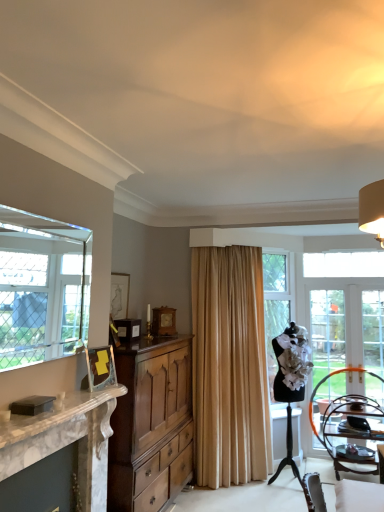
Question: Does clear glass window at left contain clear glass door at right?

Choices:
 (A) yes
 (B) no

Answer: (B)

Question: Is clear glass window at left smaller than clear glass door at right?

Choices:
 (A) no
 (B) yes

Answer: (B)

Question: Does clear glass window at left have a lesser width compared to clear glass door at right?

Choices:
 (A) yes
 (B) no

Answer: (A)

Question: Is there a large distance between clear glass window at left and clear glass door at right?

Choices:
 (A) no
 (B) yes

Answer: (B)

Question: Is clear glass window at left not inside clear glass door at right?

Choices:
 (A) yes
 (B) no

Answer: (A)

Question: From a real-world perspective, is beige fabric curtain at center above or below white marble fireplace at left?

Choices:
 (A) above
 (B) below

Answer: (A)

Question: Does point (198, 368) appear closer or farther from the camera than point (19, 437)?

Choices:
 (A) closer
 (B) farther

Answer: (B)

Question: Is beige fabric curtain at center bigger or smaller than white marble fireplace at left?

Choices:
 (A) big
 (B) small

Answer: (A)

Question: Is beige fabric curtain at center in front of or behind white marble fireplace at left in the image?

Choices:
 (A) front
 (B) behind

Answer: (B)

Question: Is point (57, 438) closer or farther from the camera than point (220, 402)?

Choices:
 (A) farther
 (B) closer

Answer: (B)

Question: In the image, is white marble fireplace at left positioned in front of or behind beige fabric curtain at center?

Choices:
 (A) front
 (B) behind

Answer: (A)

Question: Would you say white marble fireplace at left is to the left or to the right of beige fabric curtain at center in the picture?

Choices:
 (A) right
 (B) left

Answer: (B)

Question: Is white marble fireplace at left spatially inside beige fabric curtain at center, or outside of it?

Choices:
 (A) inside
 (B) outside

Answer: (B)

Question: Considering the positions of beige fabric curtain at center and wooden chair at lower right in the image, is beige fabric curtain at center taller or shorter than wooden chair at lower right?

Choices:
 (A) tall
 (B) short

Answer: (A)

Question: Is beige fabric curtain at center situated inside wooden chair at lower right or outside?

Choices:
 (A) outside
 (B) inside

Answer: (A)